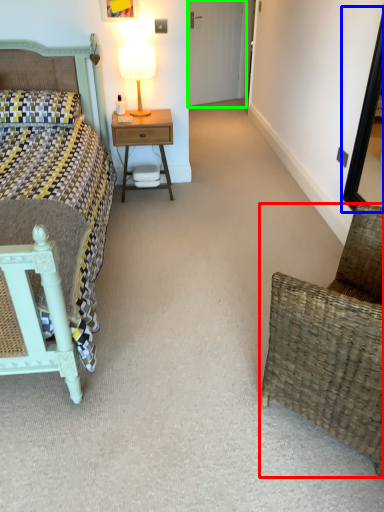
Question: Which object is positioned farthest from chair (highlighted by a red box)? Select from mirror (highlighted by a blue box) and glass door (highlighted by a green box).

Choices:
 (A) mirror
 (B) glass door

Answer: (B)